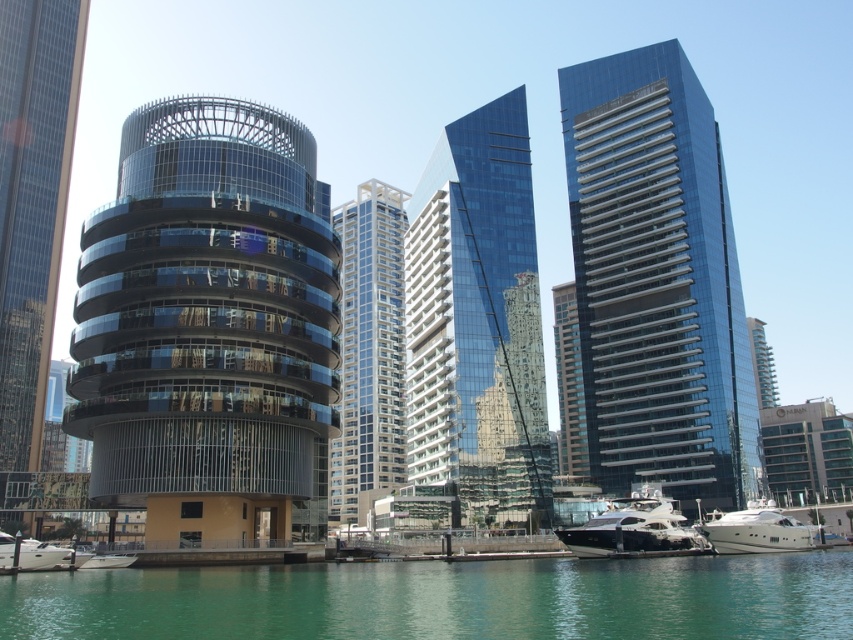
You are a photographer planning to capture the glassy metallic tower at center and the transparent glass skyscraper at center in a single shot. Based on their positions, which one is positioned to the left side of the other?

The glassy metallic tower at center is positioned to the left of the transparent glass skyscraper at center.

You are standing at the waterfront and see two points marked on the image. The first point is at coordinates point (x=677, y=529) and the second at point (x=769, y=518). Which point is closer to you?

Point (x=677, y=529) is in front of point (x=769, y=518), so it is closer to you.

You are standing on the pier and see the white glossy yacht at lower center and the white glossy yacht at lower right. Which yacht is nearer to you?

The white glossy yacht at lower center is closer to the viewer than the white glossy yacht at lower right, so it is nearer to you.